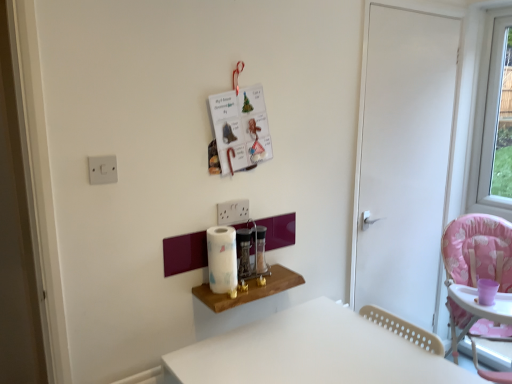
Question: From a real-world perspective, is white matte door at right physically above white matte table at lower center, marked as the 2th table in a left-to-right arrangement?

Choices:
 (A) no
 (B) yes

Answer: (B)

Question: Considering the relative sizes of white matte door at right and white matte table at lower center, the first table in the bottom-to-top sequence, in the image provided, is white matte door at right thinner than white matte table at lower center, the first table in the bottom-to-top sequence,?

Choices:
 (A) no
 (B) yes

Answer: (B)

Question: Is white matte door at right to the right of white matte table at lower center, which appears as the first table when viewed from the right, from the viewer's perspective?

Choices:
 (A) yes
 (B) no

Answer: (A)

Question: From a real-world perspective, is white matte door at right physically below white matte table at lower center, which ranks as the second table in top-to-bottom order?

Choices:
 (A) no
 (B) yes

Answer: (A)

Question: Does white matte door at right have a larger size compared to white matte table at lower center, marked as the 2th table in a left-to-right arrangement?

Choices:
 (A) yes
 (B) no

Answer: (B)

Question: Considering the positions of pink fabric highchair at right and white matte door at right in the image, is pink fabric highchair at right taller or shorter than white matte door at right?

Choices:
 (A) short
 (B) tall

Answer: (A)

Question: Looking at their shapes, would you say pink fabric highchair at right is wider or thinner than white matte door at right?

Choices:
 (A) wide
 (B) thin

Answer: (A)

Question: Would you say pink fabric highchair at right is inside or outside white matte door at right?

Choices:
 (A) inside
 (B) outside

Answer: (B)

Question: From a real-world perspective, is pink fabric highchair at right positioned above or below white matte door at right?

Choices:
 (A) above
 (B) below

Answer: (B)

Question: Considering the positions of point (273, 283) and point (509, 203), is point (273, 283) closer or farther from the camera than point (509, 203)?

Choices:
 (A) closer
 (B) farther

Answer: (A)

Question: Based on their positions, is wooden shelf at center, which is the 2th table from right to left, located to the left or right of transparent glass window at upper right?

Choices:
 (A) right
 (B) left

Answer: (B)

Question: In terms of height, does wooden shelf at center, the 1th table positioned from the top, look taller or shorter compared to transparent glass window at upper right?

Choices:
 (A) tall
 (B) short

Answer: (B)

Question: From the image's perspective, is wooden shelf at center, marked as the first table in a left-to-right arrangement, positioned above or below transparent glass window at upper right?

Choices:
 (A) above
 (B) below

Answer: (B)

Question: Is point (471, 244) closer or farther from the camera than point (245, 244)?

Choices:
 (A) closer
 (B) farther

Answer: (B)

Question: Based on their positions, is pink fabric highchair at right located to the left or right of metallic glass spice jar at center, the 2th appliance from the right?

Choices:
 (A) left
 (B) right

Answer: (B)